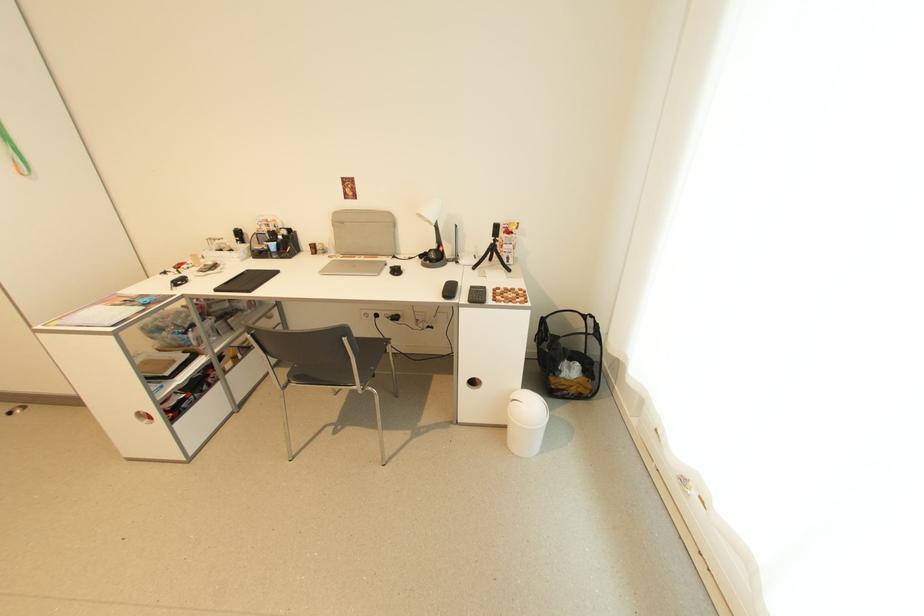
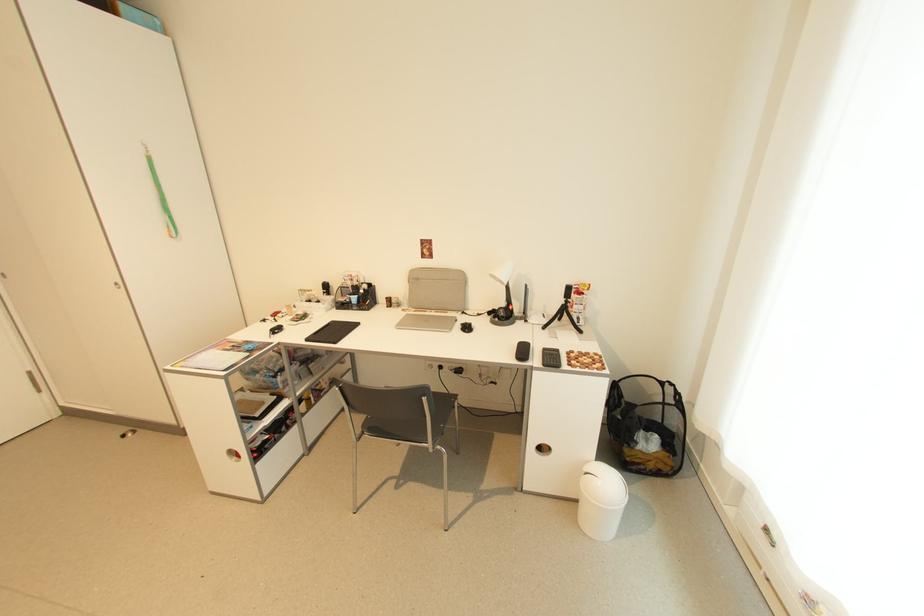
Where in the second image is the point corresponding to the point at 473,302 from the first image?

(548, 367)